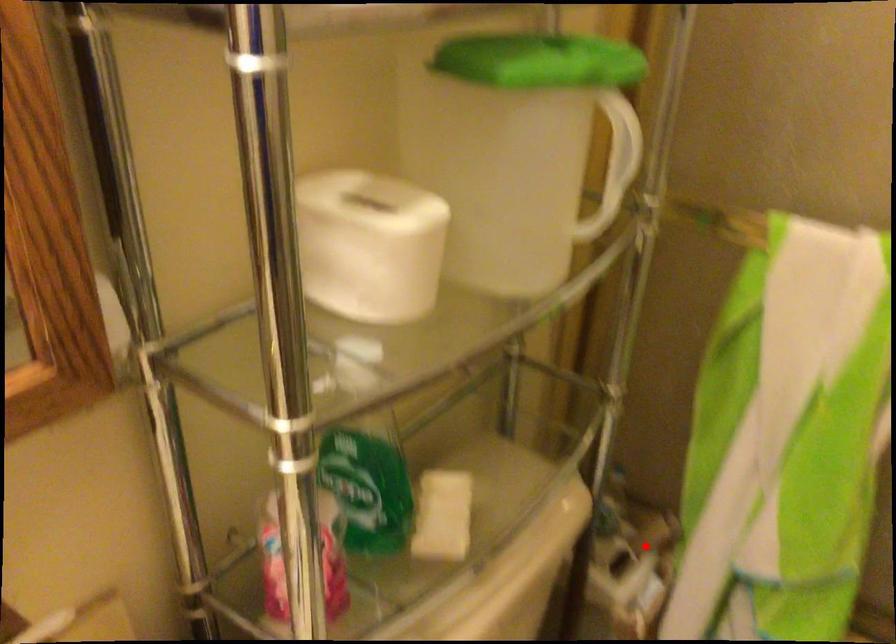
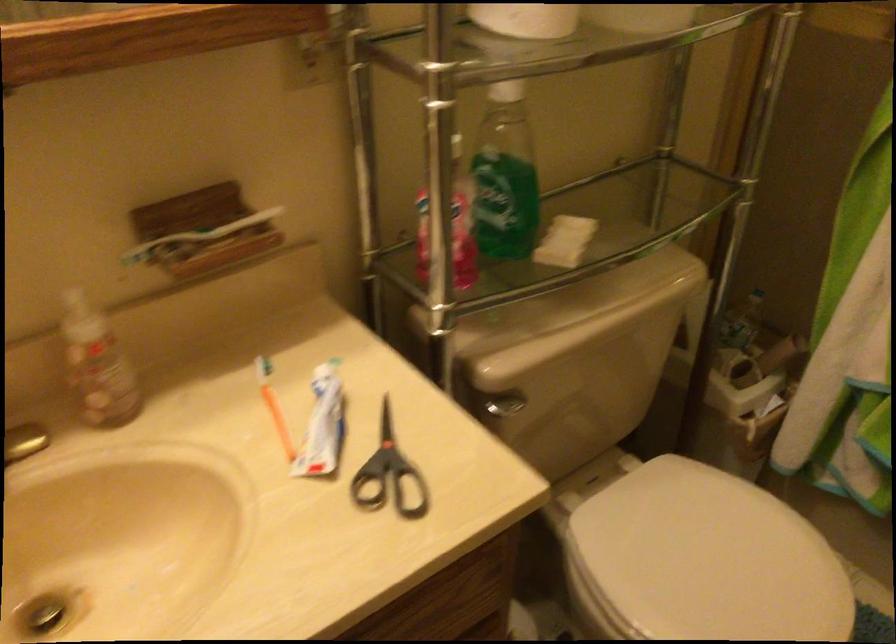
Question: I am providing you with two images of the same scene from different viewpoints. In image1, a red point is highlighted. Considering the same 3D point in image2, which of the following is correct?

Choices:
 (A) It is closer
 (B) It is farther

Answer: (B)